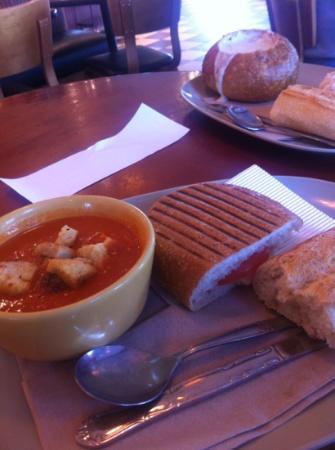
Locate an element on the screen. This screenshot has width=335, height=450. middle napkin is located at coordinates (240, 411).